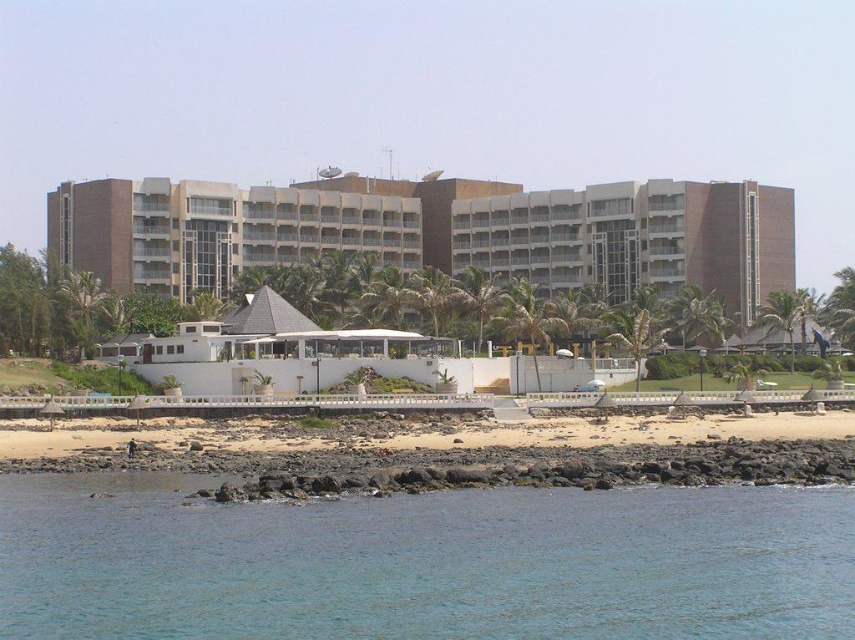
Consider the image. You are standing at the entrance of the building and want to reach both the point at coordinates point (522, 220) and the point at coordinates point (136, 452). Which point will you encounter first as you walk towards them?

You will encounter point (522, 220) first because it is closer to you than point (136, 452), which is further away.

You are standing on the beach looking at the brown concrete building at center and the brown sand at lower center. Which object is closer to you?

The brown sand at lower center is closer to you because the brown concrete building at center is further away.

You are a swimmer standing at the edge of the clear blue water at lower center. You want to swim to the brown concrete building at center. Given that your swimming speed is 2 meters per second, how long will it take you to reach the building?

The distance between the clear blue water at lower center and the brown concrete building at center is 85.46 meters. At a swimming speed of 2 meters per second, it would take approximately 42.73 seconds to reach the building.